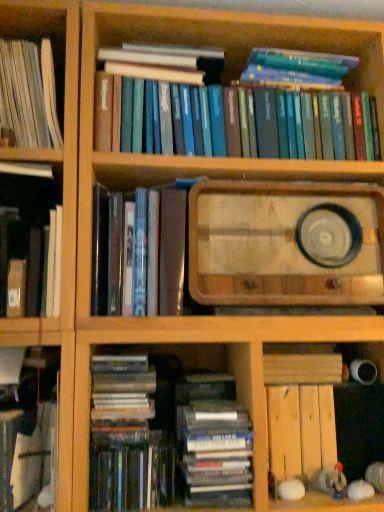
Question: Visually, is hardcover books at lower center, which appears as the 5th book when viewed from the top, positioned to the left or to the right of white paper book at left, which ranks as the first book in top-to-bottom order?

Choices:
 (A) right
 (B) left

Answer: (A)

Question: Considering the positions of hardcover books at lower center, which appears as the 5th book when viewed from the top, and white paper book at left, which ranks as the first book in top-to-bottom order, in the image, is hardcover books at lower center, which appears as the 5th book when viewed from the top, bigger or smaller than white paper book at left, which ranks as the first book in top-to-bottom order,?

Choices:
 (A) small
 (B) big

Answer: (A)

Question: Based on their relative distances, which object is farther from the hardcover book at left, the 5th book from the bottom?

Choices:
 (A) hardcover book at lower center, the first book in the bottom-to-top sequence
 (B) hardcover books at upper center, placed as the 7th book when sorted from bottom to top
 (C) white paper book at left, which is the eighth book from bottom to top
 (D) wooden radio at center
 (E) matte black book at center, arranged as the sixth book when ordered from the bottom

Answer: (D)

Question: Which object is positioned farthest from the hardcover book at lower left, arranged as the 2th book when ordered from the bottom?

Choices:
 (A) hardcover book at left, the 5th book from the bottom
 (B) white paper book at left, which ranks as the first book in top-to-bottom order
 (C) matte black book at center, arranged as the sixth book when ordered from the bottom
 (D) hardcover books at upper center, positioned as the 2th book in top-to-bottom order
 (E) hardcover books at lower center, which appears as the 5th book when viewed from the top

Answer: (D)